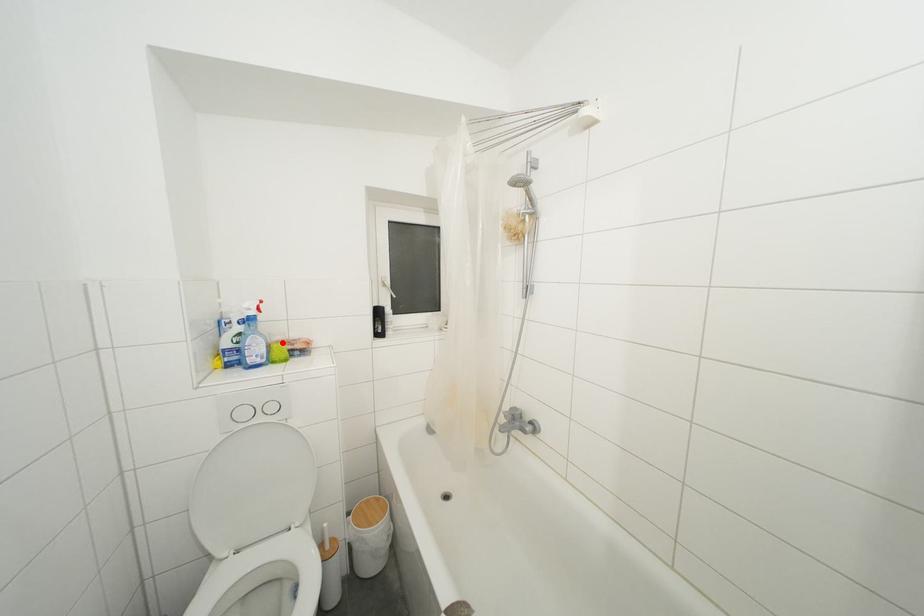
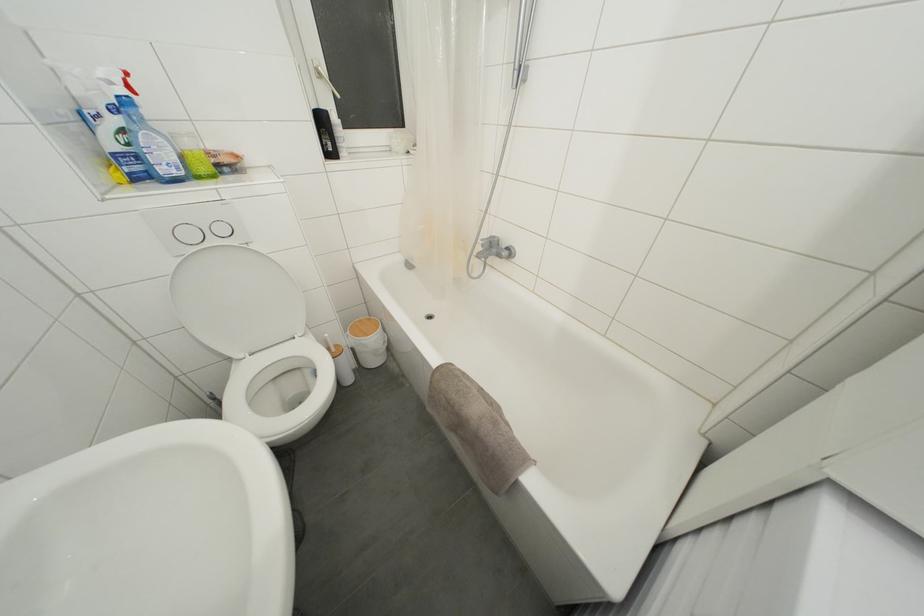
In the second image, find the point that corresponds to the highlighted location in the first image.

(193, 148)